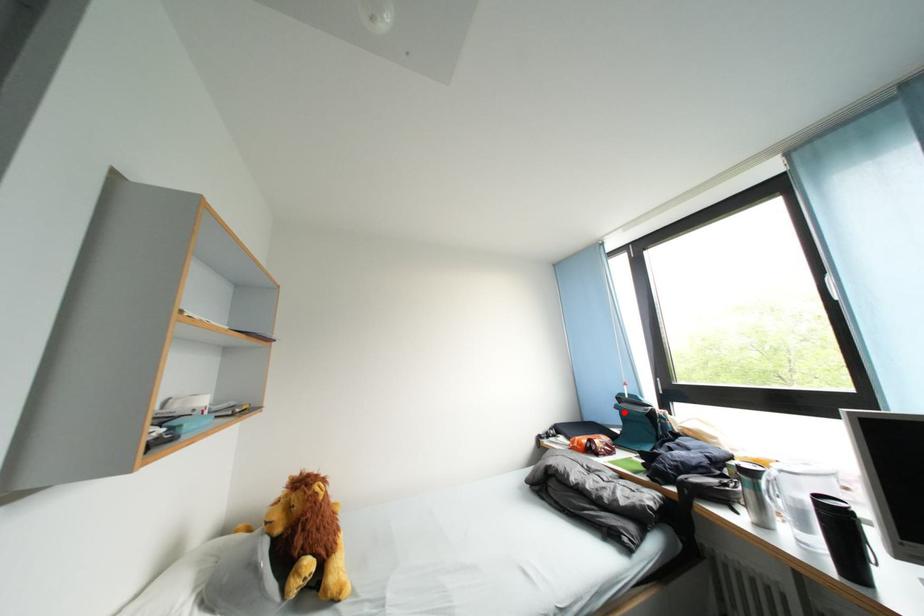
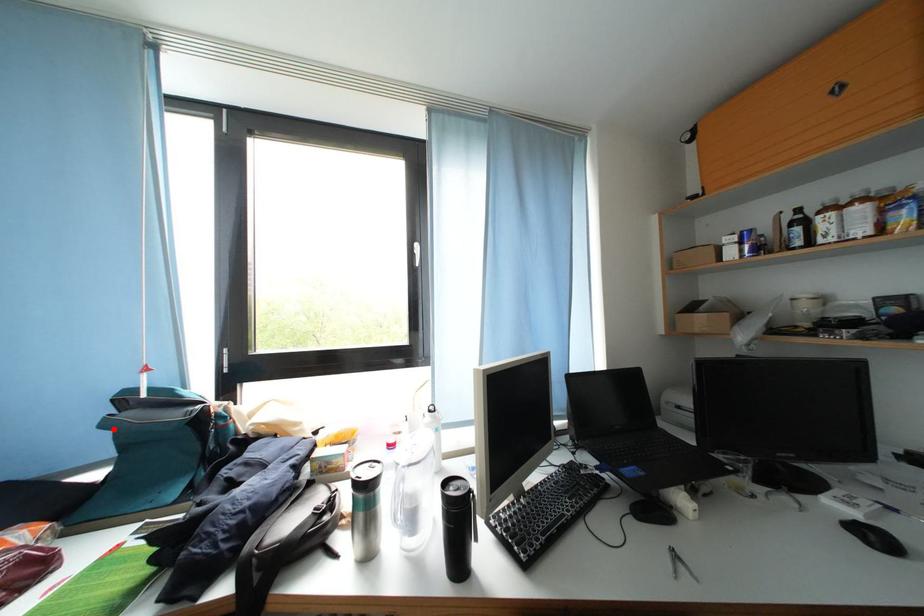
I am providing you with two images of the same scene from different viewpoints. A red point is marked on the first image and another point is marked on the second image. Is the marked point in image1 the same physical position as the marked point in image2?

Yes